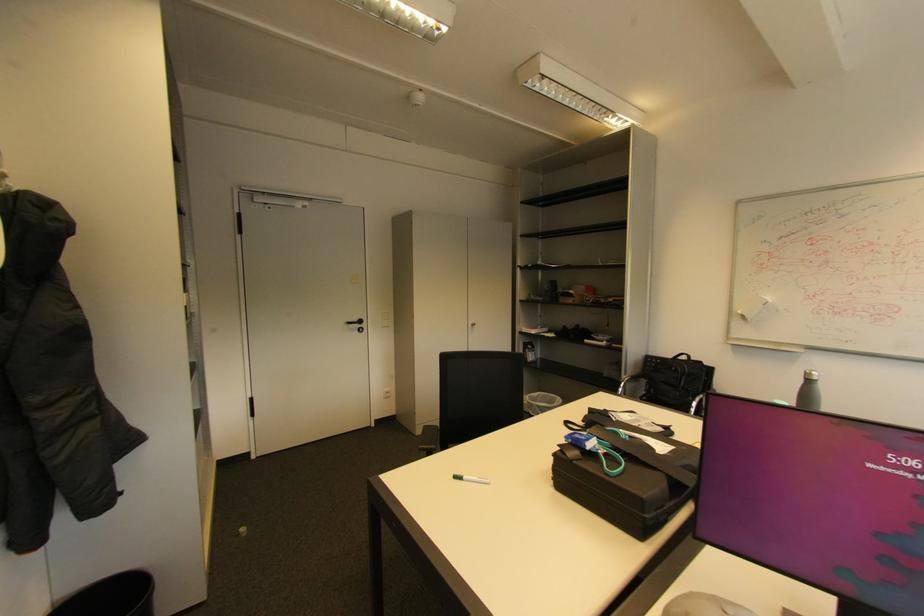
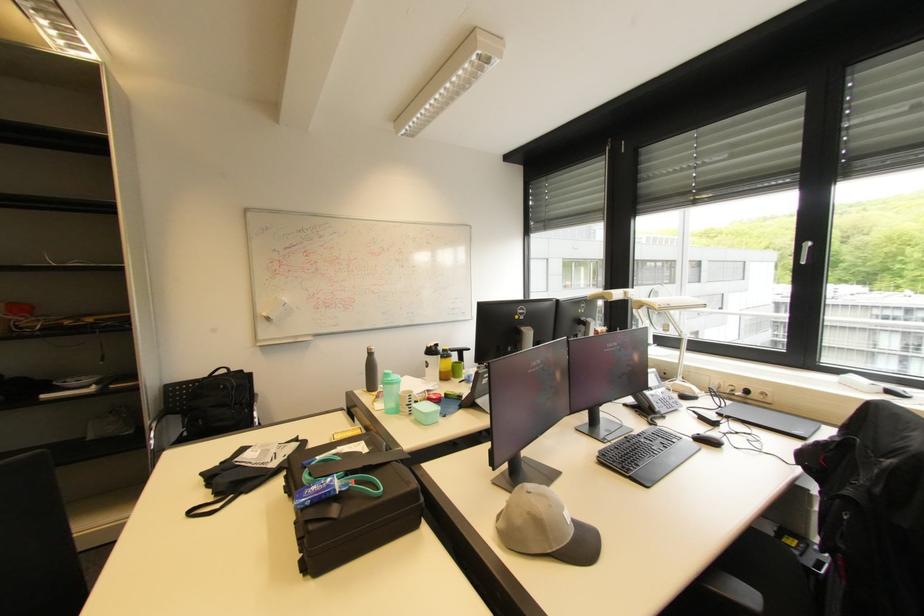
Locate, in the second image, the point that corresponds to the point at 811,373 in the first image.

(372, 350)